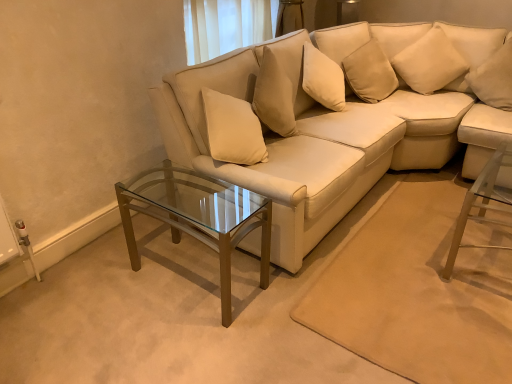
Measure the distance between soft beige pillow at upper right, the 1th pillow when ordered from left to right, and camera.

soft beige pillow at upper right, the 1th pillow when ordered from left to right, and camera are 2.90 meters apart from each other.

In order to face matte white couch at center, should I rotate leftwards or rightwards?

You should look right and rotate roughly 5.001 degrees.

You are a GUI agent. You are given a task and a screenshot of the screen. Output one action in this format:
    pyautogui.click(x=<x>, y=<y>)
    Task: Click on the clear glass coffee table at center
    Image resolution: width=512 pixels, height=384 pixels.
    Given the screenshot: What is the action you would take?
    pyautogui.click(x=198, y=216)

Locate an element on the screen. This screenshot has height=384, width=512. soft beige pillow at upper right, the 1th pillow when ordered from left to right is located at coordinates (429, 62).

Based on the photo, does white soft pillow at upper right, which is the 2th pillow from left to right, have a lesser height compared to soft beige pillow at upper right, the 1th pillow when ordered from left to right?

Yes.

Does white soft pillow at upper right, the first pillow when ordered from right to left, touch soft beige pillow at upper right, the 1th pillow when ordered from left to right?

No, white soft pillow at upper right, the first pillow when ordered from right to left, is not next to soft beige pillow at upper right, the 1th pillow when ordered from left to right.

From the picture: Looking at their sizes, would you say white soft pillow at upper right, which is the 2th pillow from left to right, is wider or thinner than soft beige pillow at upper right, the 1th pillow when ordered from left to right?

Considering their sizes, white soft pillow at upper right, which is the 2th pillow from left to right, looks broader than soft beige pillow at upper right, the 1th pillow when ordered from left to right.

Would you say white soft pillow at upper right, which is the 2th pillow from left to right, is outside soft beige pillow at upper right, the 2th pillow viewed from the right?

Yes, white soft pillow at upper right, which is the 2th pillow from left to right, is not within soft beige pillow at upper right, the 2th pillow viewed from the right.

Is white soft pillow at upper right, which is the 2th pillow from left to right, positioned with its back to matte white couch at center?

That's not correct — white soft pillow at upper right, which is the 2th pillow from left to right, is not looking away from matte white couch at center.

Considering the relative sizes of white soft pillow at upper right, which is the 2th pillow from left to right, and matte white couch at center in the image provided, is white soft pillow at upper right, which is the 2th pillow from left to right, thinner than matte white couch at center?

Yes, white soft pillow at upper right, which is the 2th pillow from left to right, is thinner than matte white couch at center.

Is white soft pillow at upper right, which is the 2th pillow from left to right, in front of matte white couch at center?

No, it is not.

Is the surface of white soft pillow at upper right, which is the 2th pillow from left to right, in direct contact with matte white couch at center?

white soft pillow at upper right, which is the 2th pillow from left to right, is not next to matte white couch at center, and they're not touching.

From the picture: Between clear glass coffee table at center and soft beige pillow at upper right, the 1th pillow when ordered from left to right, which one has more height?

Standing taller between the two is clear glass coffee table at center.

Are clear glass coffee table at center and soft beige pillow at upper right, the 2th pillow viewed from the right, located far from each other?

clear glass coffee table at center is far away from soft beige pillow at upper right, the 2th pillow viewed from the right.

Between clear glass coffee table at center and soft beige pillow at upper right, the 1th pillow when ordered from left to right, which one appears on the left side from the viewer's perspective?

clear glass coffee table at center.

From a real-world perspective, between matte white couch at center and soft beige pillow at upper right, the 1th pillow when ordered from left to right, who is vertically lower?

matte white couch at center is physically lower.

Considering the positions of objects matte white couch at center and soft beige pillow at upper right, the 2th pillow viewed from the right, in the image provided, who is more to the right, matte white couch at center or soft beige pillow at upper right, the 2th pillow viewed from the right,?

soft beige pillow at upper right, the 2th pillow viewed from the right, is more to the right.

Is the depth of matte white couch at center greater than that of soft beige pillow at upper right, the 1th pillow when ordered from left to right?

No, matte white couch at center is closer to the viewer.

Based on the photo, how different are the orientations of soft beige pillow at upper right, the 1th pillow when ordered from left to right, and matte white couch at center in degrees?

64 degrees separate the facing orientations of soft beige pillow at upper right, the 1th pillow when ordered from left to right, and matte white couch at center.

Which is in front, soft beige pillow at upper right, the 2th pillow viewed from the right, or matte white couch at center?

matte white couch at center is in front.

Between point (438, 45) and point (284, 97), which one is positioned in front?

The point (284, 97) is more forward.

Is clear glass coffee table at center aimed at white soft pillow at upper right, which is the 2th pillow from left to right?

No, clear glass coffee table at center is not oriented towards white soft pillow at upper right, which is the 2th pillow from left to right.

In terms of height, does clear glass coffee table at center look taller or shorter compared to white soft pillow at upper right, which is the 2th pillow from left to right?

Clearly, clear glass coffee table at center is taller compared to white soft pillow at upper right, which is the 2th pillow from left to right.

From the image's perspective, does clear glass coffee table at center appear lower than white soft pillow at upper right, the first pillow when ordered from right to left?

Yes.

Looking at their sizes, would you say clear glass coffee table at center is wider or thinner than white soft pillow at upper right, the first pillow when ordered from right to left?

clear glass coffee table at center is wider than white soft pillow at upper right, the first pillow when ordered from right to left.

Considering the relative sizes of white soft pillow at upper right, which is the 2th pillow from left to right, and clear glass coffee table at center in the image provided, is white soft pillow at upper right, which is the 2th pillow from left to right, smaller than clear glass coffee table at center?

Correct, white soft pillow at upper right, which is the 2th pillow from left to right, occupies less space than clear glass coffee table at center.

In the scene shown: Does white soft pillow at upper right, which is the 2th pillow from left to right, have a lesser width compared to clear glass coffee table at center?

Yes, white soft pillow at upper right, which is the 2th pillow from left to right, is thinner than clear glass coffee table at center.

Is white soft pillow at upper right, which is the 2th pillow from left to right, with clear glass coffee table at center?

white soft pillow at upper right, which is the 2th pillow from left to right, and clear glass coffee table at center are clearly separated.

Is clear glass coffee table at center surrounded by white soft pillow at upper right, the first pillow when ordered from right to left?

No, clear glass coffee table at center is located outside of white soft pillow at upper right, the first pillow when ordered from right to left.

Locate an element on the screen. pillow above the white soft pillow at upper right, the first pillow when ordered from right to left (from the image's perspective) is located at coordinates (429, 62).

There is a matte white couch at center. Identify the location of the 1st pillow above it (from a real-world perspective). pyautogui.click(x=494, y=78).

Considering their positions, is soft beige pillow at upper right, the 1th pillow when ordered from left to right, positioned closer to matte white couch at center than clear glass coffee table at center?

Based on the image, soft beige pillow at upper right, the 1th pillow when ordered from left to right, appears to be nearer to matte white couch at center.

Looking at the image, which one is located closer to soft beige pillow at upper right, the 2th pillow viewed from the right, white soft pillow at upper right, the first pillow when ordered from right to left, or matte white couch at center?

The object closer to soft beige pillow at upper right, the 2th pillow viewed from the right, is white soft pillow at upper right, the first pillow when ordered from right to left.

When comparing their distances from clear glass coffee table at center, does white soft pillow at upper right, which is the 2th pillow from left to right, or soft beige pillow at upper right, the 2th pillow viewed from the right, seem closer?

Based on the image, soft beige pillow at upper right, the 2th pillow viewed from the right, appears to be nearer to clear glass coffee table at center.

Based on their spatial positions, is white soft pillow at upper right, which is the 2th pillow from left to right, or clear glass coffee table at center closer to matte white couch at center?

Among the two, clear glass coffee table at center is located nearer to matte white couch at center.

When comparing their distances from clear glass coffee table at center, does matte white couch at center or white soft pillow at upper right, which is the 2th pillow from left to right, seem further?

white soft pillow at upper right, which is the 2th pillow from left to right, is further to clear glass coffee table at center.

Considering their positions, is soft beige pillow at upper right, the 1th pillow when ordered from left to right, positioned further to clear glass coffee table at center than white soft pillow at upper right, the first pillow when ordered from right to left?

Based on the image, white soft pillow at upper right, the first pillow when ordered from right to left, appears to be further to clear glass coffee table at center.

From the image, which object appears to be nearer to clear glass coffee table at center, soft beige pillow at upper right, the 1th pillow when ordered from left to right, or matte white couch at center?

Based on the image, matte white couch at center appears to be nearer to clear glass coffee table at center.

From the image, which object appears to be farther from soft beige pillow at upper right, the 1th pillow when ordered from left to right, matte white couch at center or white soft pillow at upper right, which is the 2th pillow from left to right?

The object further to soft beige pillow at upper right, the 1th pillow when ordered from left to right, is matte white couch at center.

Find the location of a particular element. The height and width of the screenshot is (384, 512). studio couch situated between clear glass coffee table at center and soft beige pillow at upper right, the 2th pillow viewed from the right, from left to right is located at coordinates (330, 117).

I want to click on pillow between clear glass coffee table at center and white soft pillow at upper right, which is the 2th pillow from left to right, so click(x=429, y=62).

The height and width of the screenshot is (384, 512). I want to click on studio couch situated between clear glass coffee table at center and white soft pillow at upper right, the first pillow when ordered from right to left, from left to right, so click(x=330, y=117).

Locate an element on the screen. pillow between matte white couch at center and white soft pillow at upper right, which is the 2th pillow from left to right is located at coordinates (429, 62).